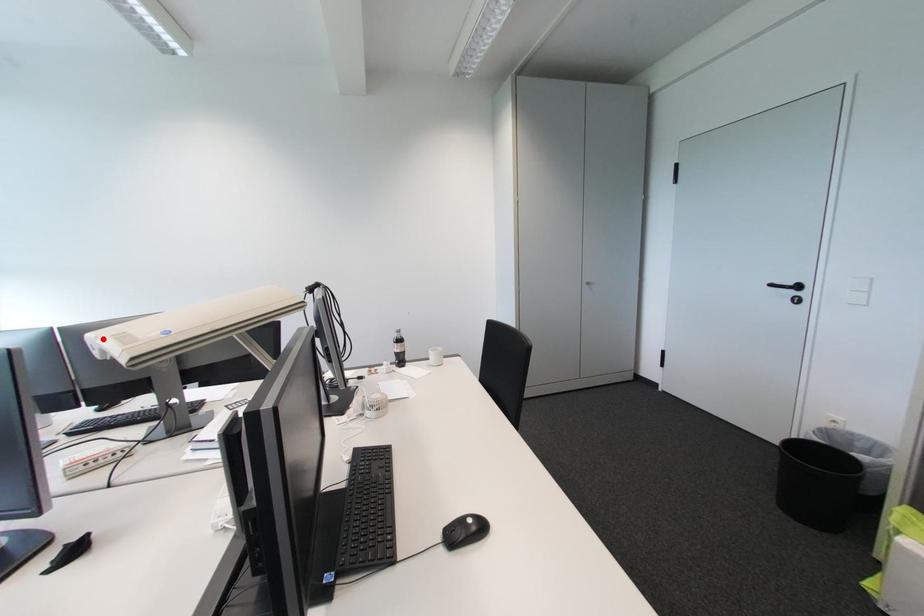
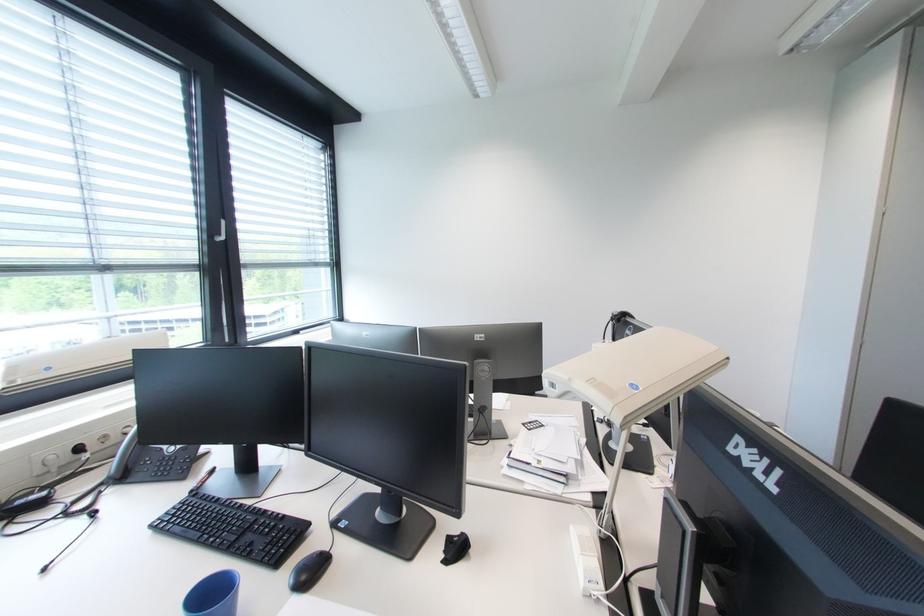
The point at the highlighted location is marked in the first image. Where is the corresponding point in the second image?

(577, 381)